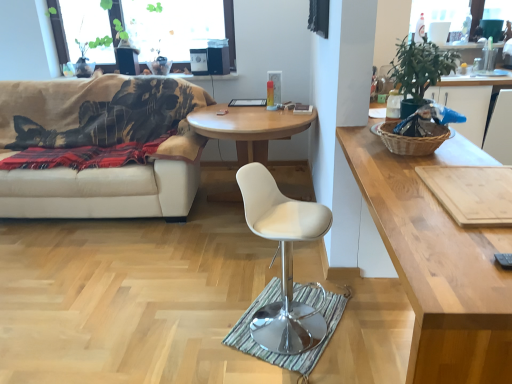
Question: Is the depth of green leafy plant at upper right greater than that of brown woven picnic basket at right?

Choices:
 (A) no
 (B) yes

Answer: (B)

Question: Is green leafy plant at upper right oriented towards brown woven picnic basket at right?

Choices:
 (A) yes
 (B) no

Answer: (B)

Question: Is green leafy plant at upper right shorter than brown woven picnic basket at right?

Choices:
 (A) no
 (B) yes

Answer: (A)

Question: Can you confirm if green leafy plant at upper right is positioned to the left of brown woven picnic basket at right?

Choices:
 (A) no
 (B) yes

Answer: (A)

Question: Is green leafy plant at upper right facing away from brown woven picnic basket at right?

Choices:
 (A) no
 (B) yes

Answer: (A)

Question: Is there a large distance between green leafy plant at upper right and brown woven picnic basket at right?

Choices:
 (A) yes
 (B) no

Answer: (B)

Question: From a real-world perspective, is transparent glass window at upper center on top of light brown wooden cutting board at right, the 2th coffee table in the back-to-front sequence?

Choices:
 (A) no
 (B) yes

Answer: (B)

Question: Is transparent glass window at upper center positioned with its back to light brown wooden cutting board at right, acting as the second coffee table starting from the left?

Choices:
 (A) yes
 (B) no

Answer: (B)

Question: Considering the relative sizes of transparent glass window at upper center and light brown wooden cutting board at right, the first coffee table in the right-to-left sequence, in the image provided, is transparent glass window at upper center thinner than light brown wooden cutting board at right, the first coffee table in the right-to-left sequence,?

Choices:
 (A) no
 (B) yes

Answer: (B)

Question: Does transparent glass window at upper center appear on the left side of light brown wooden cutting board at right, which ranks as the 1th coffee table in front-to-back order?

Choices:
 (A) yes
 (B) no

Answer: (A)

Question: From the image's perspective, does transparent glass window at upper center appear higher than light brown wooden cutting board at right, the 2th coffee table in the back-to-front sequence?

Choices:
 (A) no
 (B) yes

Answer: (B)

Question: Considering the relative sizes of transparent glass window at upper center and light brown wooden cutting board at right, the 2th coffee table in the back-to-front sequence, in the image provided, is transparent glass window at upper center bigger than light brown wooden cutting board at right, the 2th coffee table in the back-to-front sequence,?

Choices:
 (A) yes
 (B) no

Answer: (B)

Question: Can you confirm if wooden round table at center, the second coffee table viewed from the right, is thinner than brown woven picnic basket at right?

Choices:
 (A) no
 (B) yes

Answer: (A)